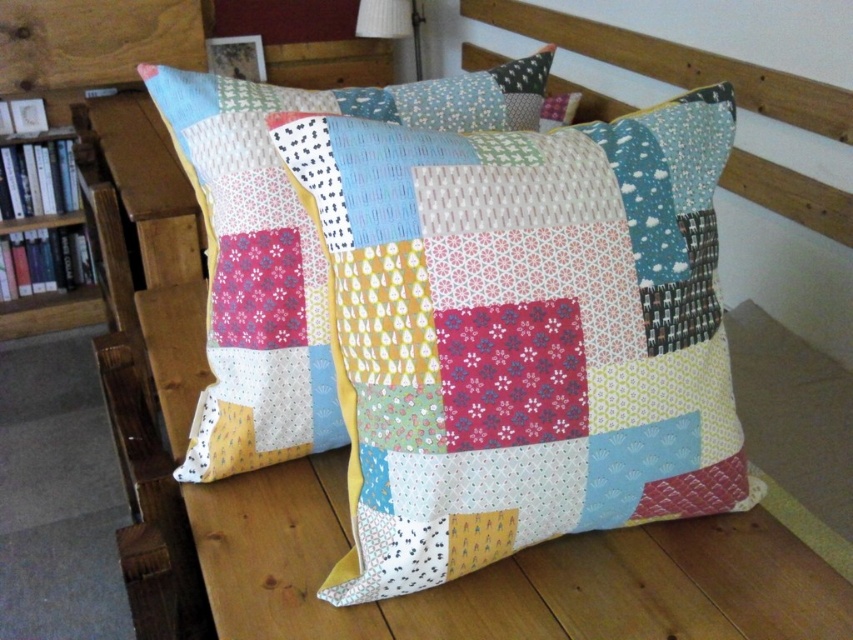
Question: Which of the following is the farthest from the observer?

Choices:
 (A) (596, 147)
 (B) (387, 26)

Answer: (B)

Question: Which of the following is the farthest from the observer?

Choices:
 (A) wooden bookcase at left
 (B) white fabric lampshade at upper center

Answer: (B)

Question: Does patchwork fabric pillow at center appear on the left side of white fabric lampshade at upper center?

Choices:
 (A) no
 (B) yes

Answer: (A)

Question: Does patchwork fabric pillow at center come behind wooden bookcase at left?

Choices:
 (A) yes
 (B) no

Answer: (B)

Question: Is patchwork fabric pillow at center further to camera compared to white fabric lampshade at upper center?

Choices:
 (A) yes
 (B) no

Answer: (B)

Question: Which point is closer to the camera?

Choices:
 (A) wooden bookcase at left
 (B) white fabric lampshade at upper center

Answer: (A)